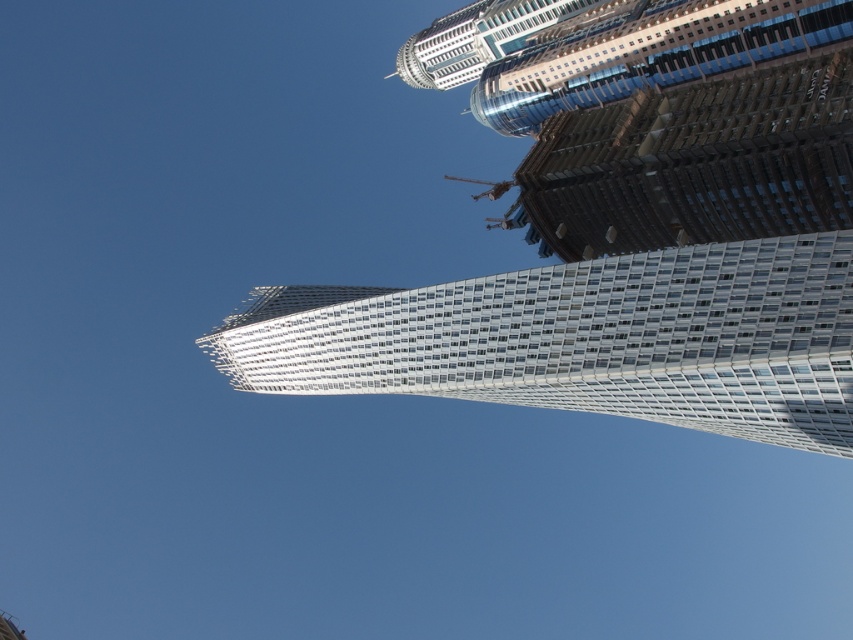
Is white glass building at center positioned at the back of metallic glass skyscraper at upper center?

No.

Which is in front, point (709, 358) or point (469, 20)?

Point (709, 358) is in front.

Between point (436, 342) and point (496, 20), which one is positioned behind?

Positioned behind is point (496, 20).

Where is `white glass building at center`? white glass building at center is located at coordinates (585, 339).